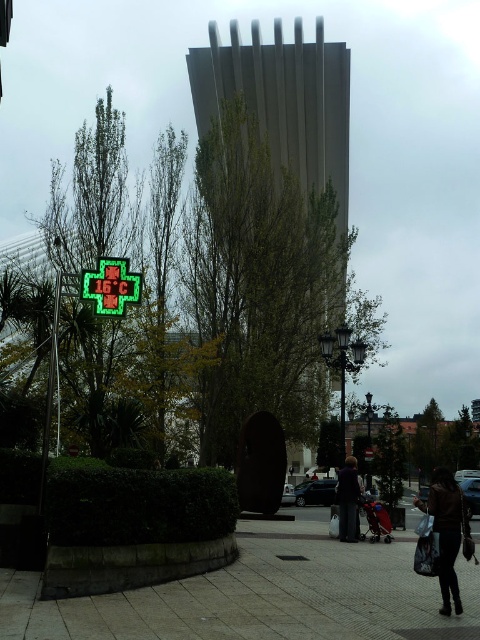
You are a delivery person trying to deliver a package to the smooth gray tower at center, but there is a dark brown leather jacket at lower right in the way. Can you see the tower from your current position?

The dark brown leather jacket at lower right is behind the smooth gray tower at center, so yes, you can see the smooth gray tower at center from your current position because the jacket is not blocking it.

Looking at this image, you are a delivery person needing to place a package between the smooth gray tower at center and the dark brown leather jacket at lower right. Which side of the jacket should you place it on?

The smooth gray tower at center is positioned on the left side of dark brown leather jacket at lower right, so you should place the package to the right side of the dark brown leather jacket at lower right.